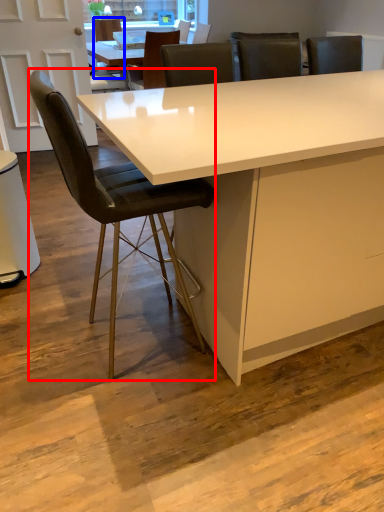
Question: Which point is further to the camera, chair (highlighted by a red box) or chair (highlighted by a blue box)?

Choices:
 (A) chair
 (B) chair

Answer: (B)